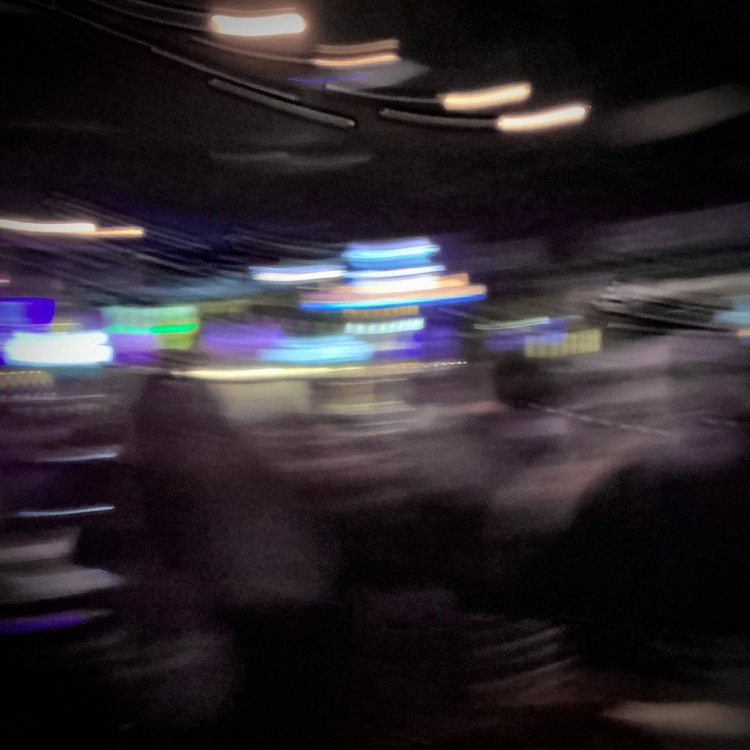
The image size is (750, 750). I want to click on light, so 68,223, 494,92, 523,122, 264,22.